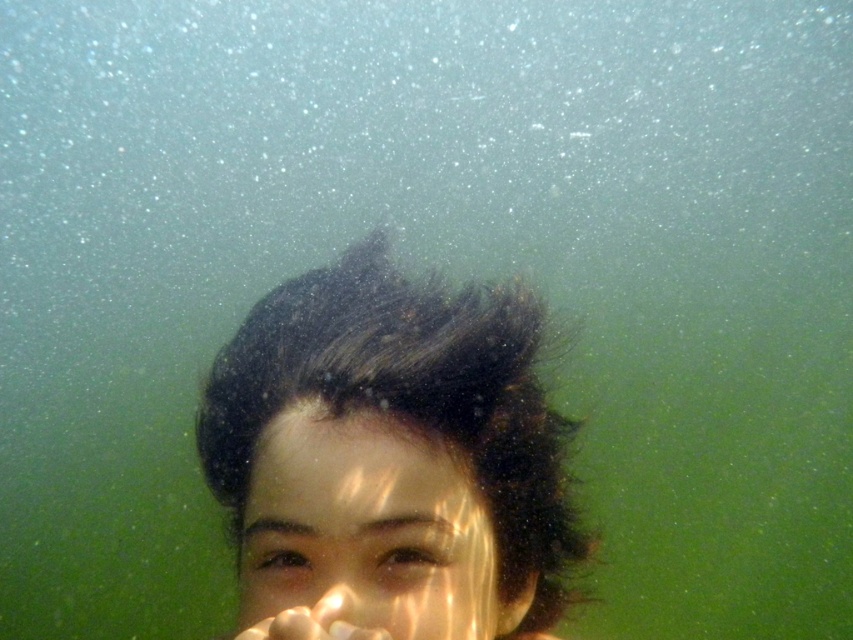
You are a diver navigating an underwater scene. You see two points marked in the image. Which point is closer to you, point (212, 486) or point (368, 592)?

Point (212, 486) is closer to you because it is further to the viewer than point (368, 592).